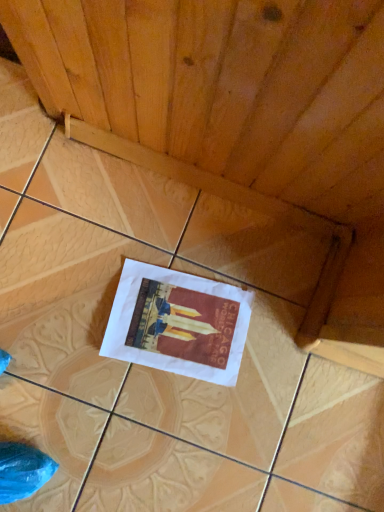
Identify the location of vacant space situated above white paper poster at center (from a real-world perspective). The height and width of the screenshot is (512, 384). (176, 322).